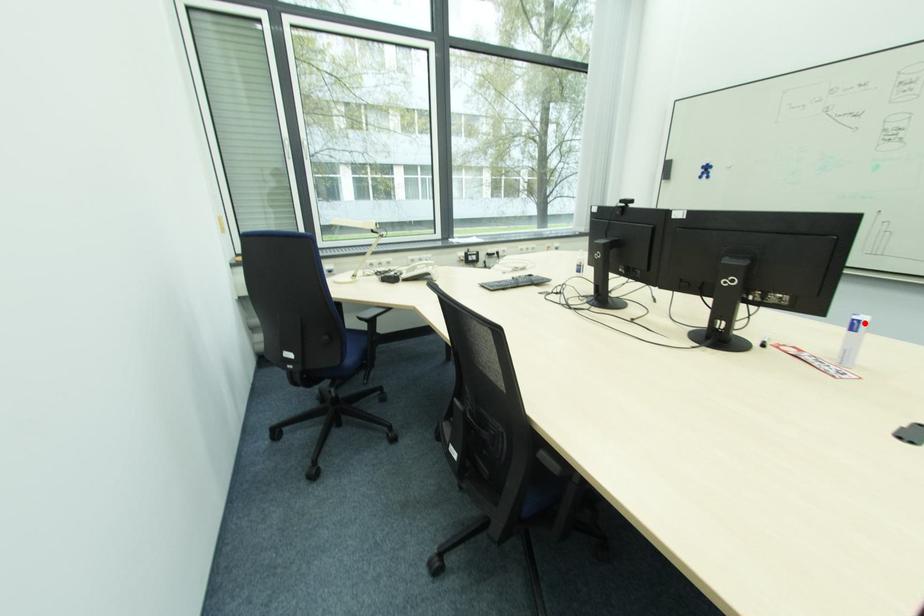
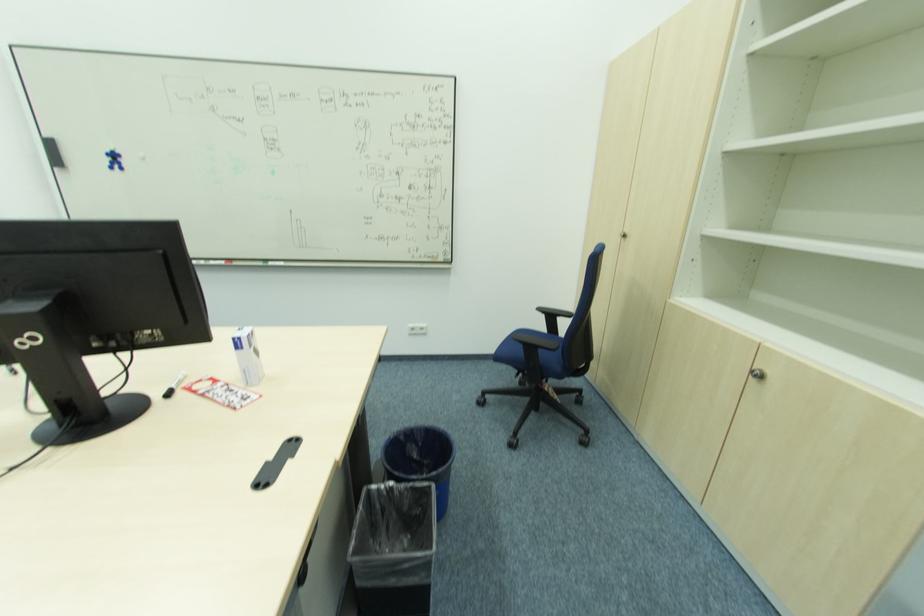
Question: A red point is marked in image1. In image2, is the corresponding 3D point closer to the camera or farther? Reply with the corresponding letter.

Choices:
 (A) The corresponding 3D point is closer.
 (B) The corresponding 3D point is farther.

Answer: (A)